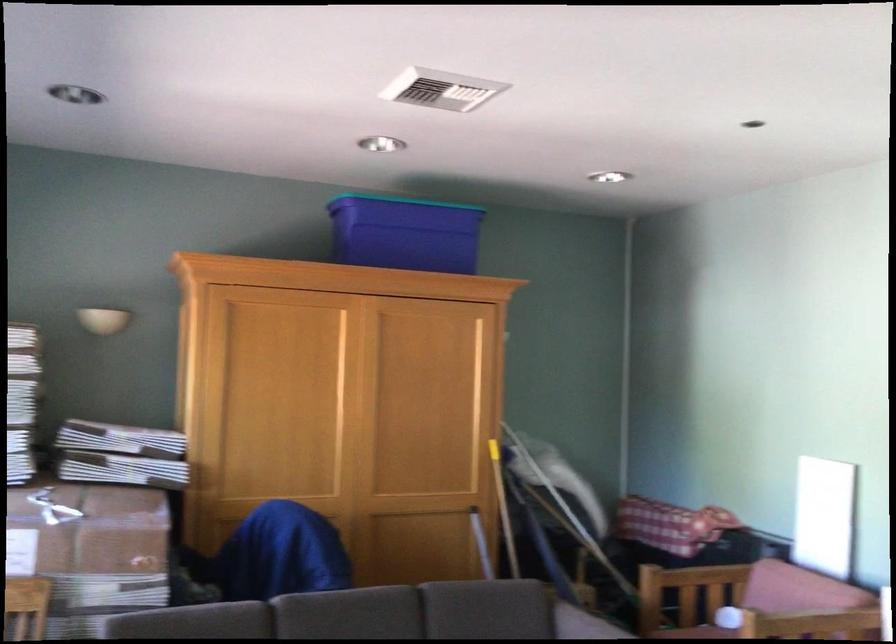
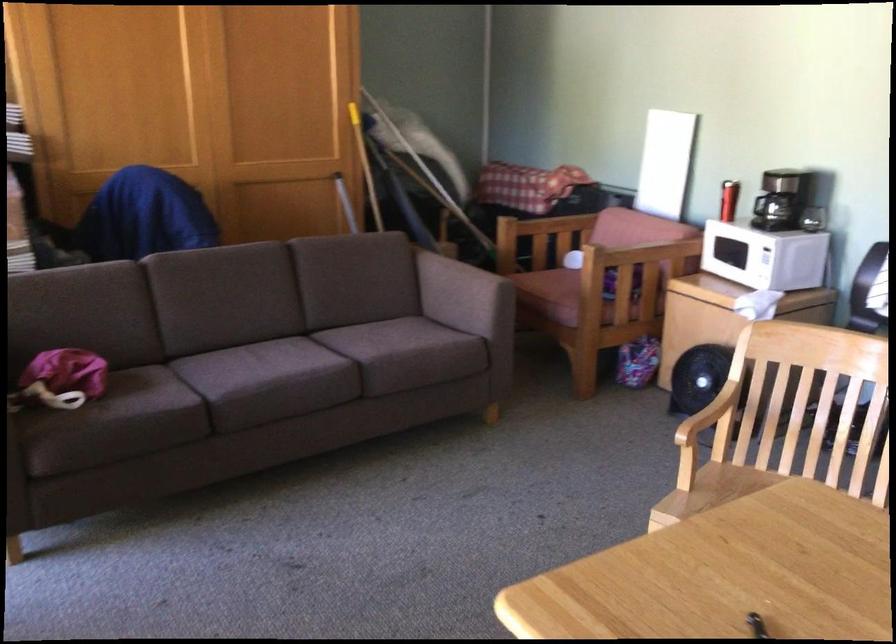
Question: The first image is from the beginning of the video and the second image is from the end. How did the camera likely rotate when shooting the video?

Choices:
 (A) Left
 (B) Right
 (C) Up
 (D) Down

Answer: (D)